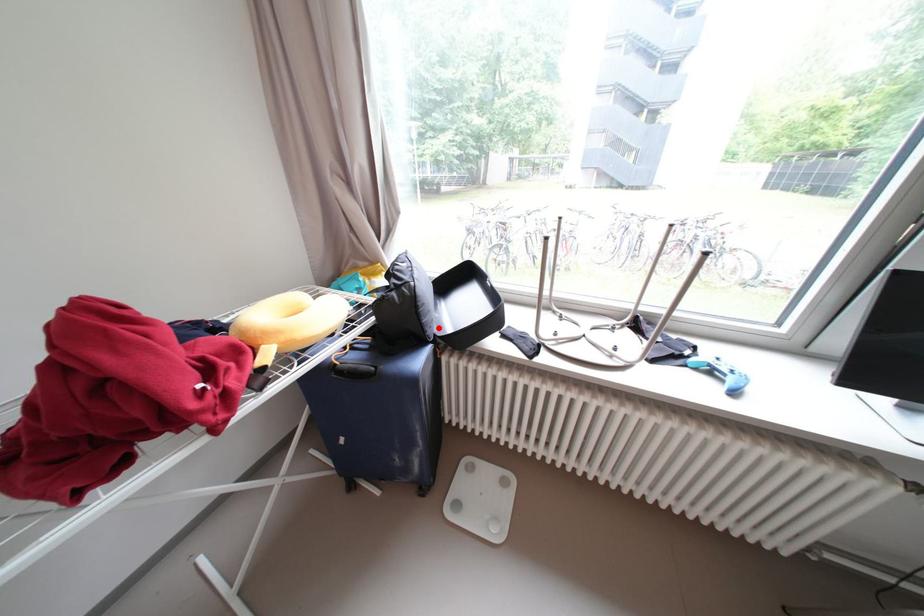
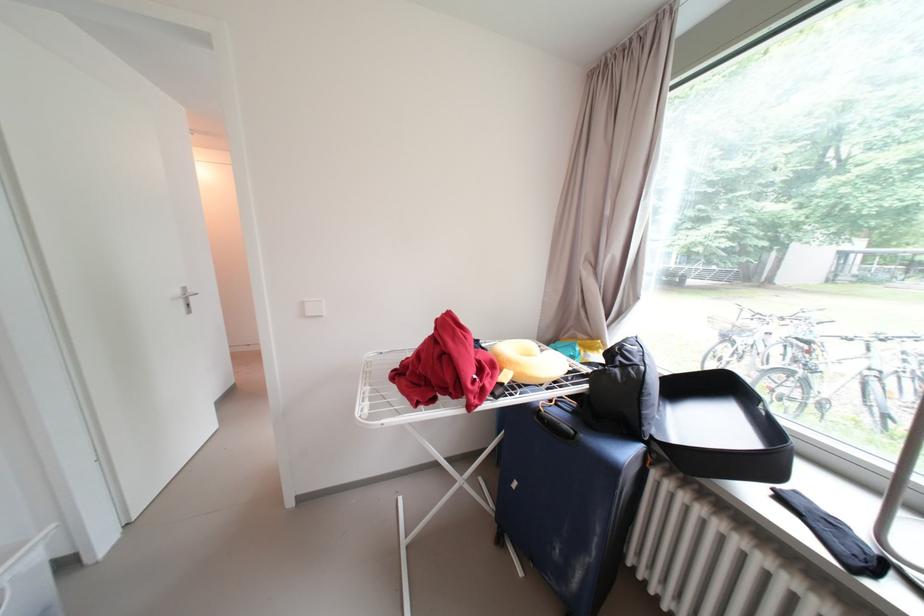
Where in the second image is the point corresponding to the highlighted location from the first image?

(658, 424)